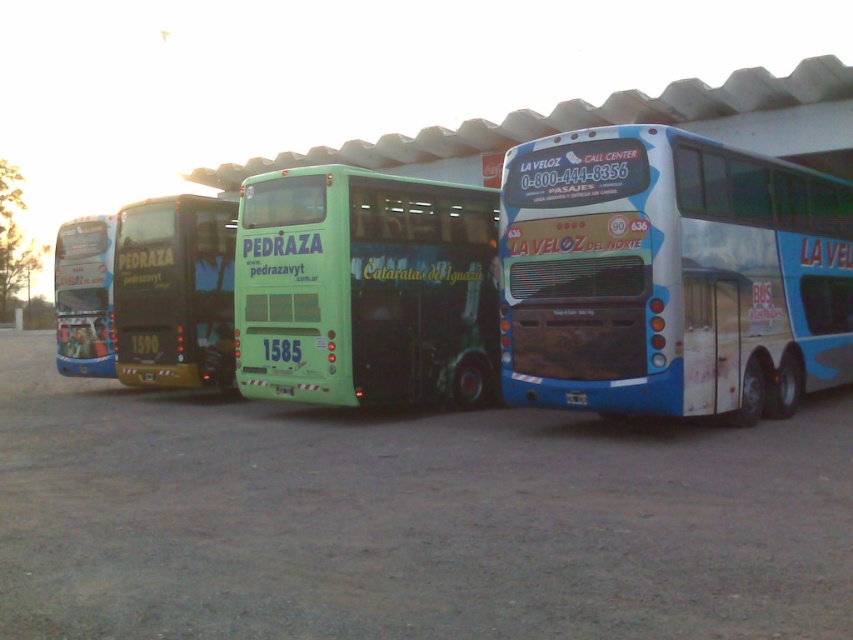
Question: Which of the following is the closest to the observer?

Choices:
 (A) blue painted bus at right
 (B) metallic gold bus at center
 (C) matte blue bus at left

Answer: (A)

Question: Does blue painted bus at right appear on the right side of matte blue bus at left?

Choices:
 (A) no
 (B) yes

Answer: (B)

Question: Which object is positioned farthest from the blue painted bus at right?

Choices:
 (A) green matte bus at center
 (B) metallic gold bus at center
 (C) matte blue bus at left

Answer: (C)

Question: Which point is closer to the camera taking this photo?

Choices:
 (A) 108,307
 (B) 231,276

Answer: (B)

Question: Is green matte bus at center smaller than metallic gold bus at center?

Choices:
 (A) yes
 (B) no

Answer: (B)

Question: Is blue painted bus at right in front of metallic gold bus at center?

Choices:
 (A) yes
 (B) no

Answer: (A)